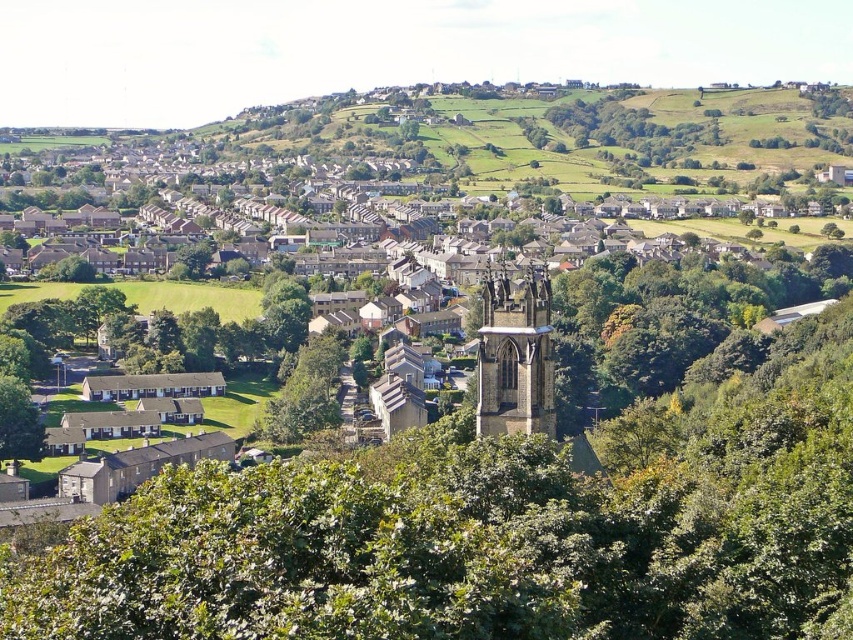
You are standing at the center of the suburban area shown in the image. You want to locate the dark gray stone tower at center. In which direction should you look to see it?

Since the dark gray stone tower at center is located at point coordinates of (515, 356), you should look towards the center of the image to see it.

Looking at this image, you are standing at the elevated viewpoint and want to determine the relative positions of two points marked in the image. Which point is closer to you, point at (704, 432) or point at (697, 140)?

Point at (704, 432) is in front of point at (697, 140), so it is closer to you.

In the scene shown: You are a drone operator trying to capture aerial footage of the suburban area. You notice the green leafy tree at center and the dark gray stone tower at center. Which object would block your view more if you fly directly towards them?

The green leafy tree at center has a larger size compared to the dark gray stone tower at center, so it would block your view more when flying directly towards them.